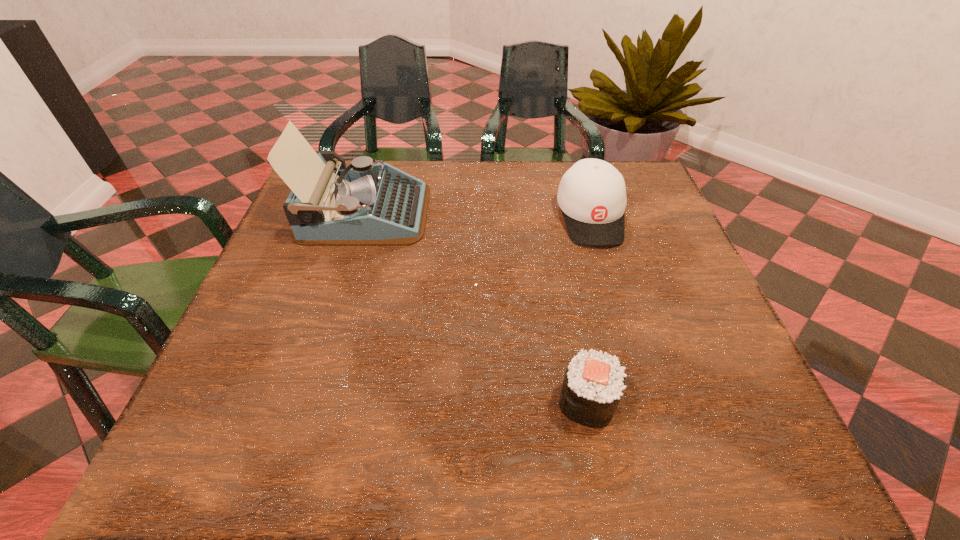
Where is `typewriter`? The width and height of the screenshot is (960, 540). typewriter is located at coordinates (366, 204).

Where is `the tallest object`? This screenshot has width=960, height=540. the tallest object is located at coordinates (366, 204).

This screenshot has height=540, width=960. What are the coordinates of `the second shortest object` in the screenshot? It's located at (592, 194).

Locate an element on the screen. The image size is (960, 540). the shortest object is located at coordinates (593, 384).

Locate an element on the screen. sushi is located at coordinates (593, 384).

I want to click on vacant region located on the typing side of the typewriter, so click(539, 213).

Locate an element on the screen. vacant space situated 0.090m on the front-facing side of the second tallest object is located at coordinates (608, 278).

Identify the location of free spot located on the left of the nearest object. This screenshot has height=540, width=960. (343, 402).

Image resolution: width=960 pixels, height=540 pixels. Identify the location of typewriter present at the far edge. (366, 204).

Image resolution: width=960 pixels, height=540 pixels. Identify the location of baseball cap that is at the far edge. (592, 194).